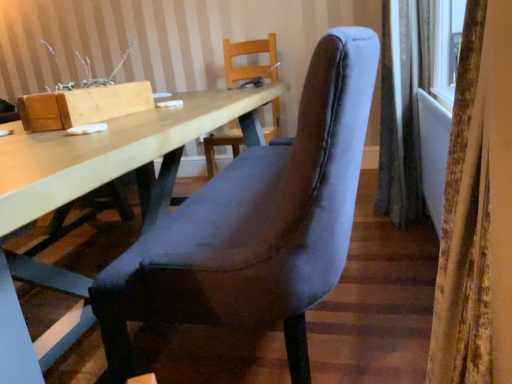
Question: Considering the relative sizes of gray fabric curtain at right, the second curtain from the front, and velvet curtain at right, the 1th curtain viewed from the front, in the image provided, is gray fabric curtain at right, the second curtain from the front, wider than velvet curtain at right, the 1th curtain viewed from the front,?

Choices:
 (A) yes
 (B) no

Answer: (A)

Question: Does gray fabric curtain at right, the second curtain from the front, have a lesser width compared to velvet curtain at right, the 2th curtain in the right-to-left sequence?

Choices:
 (A) yes
 (B) no

Answer: (B)

Question: From the image's perspective, is gray fabric curtain at right, which ranks as the 2th curtain in left-to-right order, on top of velvet curtain at right, which is the 1th curtain from left to right?

Choices:
 (A) yes
 (B) no

Answer: (A)

Question: Is velvet curtain at right, the 2th curtain in the right-to-left sequence, surrounded by gray fabric curtain at right, which ranks as the 2th curtain in left-to-right order?

Choices:
 (A) no
 (B) yes

Answer: (A)

Question: Is gray fabric curtain at right, arranged as the first curtain when viewed from the right, positioned beyond the bounds of velvet curtain at right, positioned as the 2th curtain in back-to-front order?

Choices:
 (A) yes
 (B) no

Answer: (A)

Question: Considering the positions of velvet curtain at right, the 2th curtain in the right-to-left sequence, and velvet grey chair at center in the image, is velvet curtain at right, the 2th curtain in the right-to-left sequence, taller or shorter than velvet grey chair at center?

Choices:
 (A) short
 (B) tall

Answer: (A)

Question: Would you say velvet curtain at right, the 2th curtain in the right-to-left sequence, is to the left or to the right of velvet grey chair at center in the picture?

Choices:
 (A) right
 (B) left

Answer: (A)

Question: From a real-world perspective, is velvet curtain at right, which is the 1th curtain from left to right, physically located above or below velvet grey chair at center?

Choices:
 (A) above
 (B) below

Answer: (A)

Question: From the image's perspective, relative to velvet grey chair at center, is velvet curtain at right, positioned as the 2th curtain in back-to-front order, above or below?

Choices:
 (A) below
 (B) above

Answer: (A)

Question: Looking at their shapes, would you say gray fabric curtain at right, which ranks as the 2th curtain in left-to-right order, is wider or thinner than velvet grey chair at center?

Choices:
 (A) wide
 (B) thin

Answer: (B)

Question: From their relative heights in the image, would you say gray fabric curtain at right, the second curtain from the front, is taller or shorter than velvet grey chair at center?

Choices:
 (A) short
 (B) tall

Answer: (B)

Question: Is gray fabric curtain at right, arranged as the first curtain when viewed from the right, situated inside velvet grey chair at center or outside?

Choices:
 (A) outside
 (B) inside

Answer: (A)

Question: In the image, is gray fabric curtain at right, arranged as the first curtain when viewed from the right, on the left side or the right side of velvet grey chair at center?

Choices:
 (A) right
 (B) left

Answer: (A)

Question: Visually, is velvet grey chair at center positioned to the left or to the right of gray fabric curtain at right, arranged as the first curtain when viewed from the right?

Choices:
 (A) left
 (B) right

Answer: (A)

Question: Considering the positions of velvet grey chair at center and gray fabric curtain at right, the second curtain from the front, in the image, is velvet grey chair at center taller or shorter than gray fabric curtain at right, the second curtain from the front,?

Choices:
 (A) short
 (B) tall

Answer: (A)